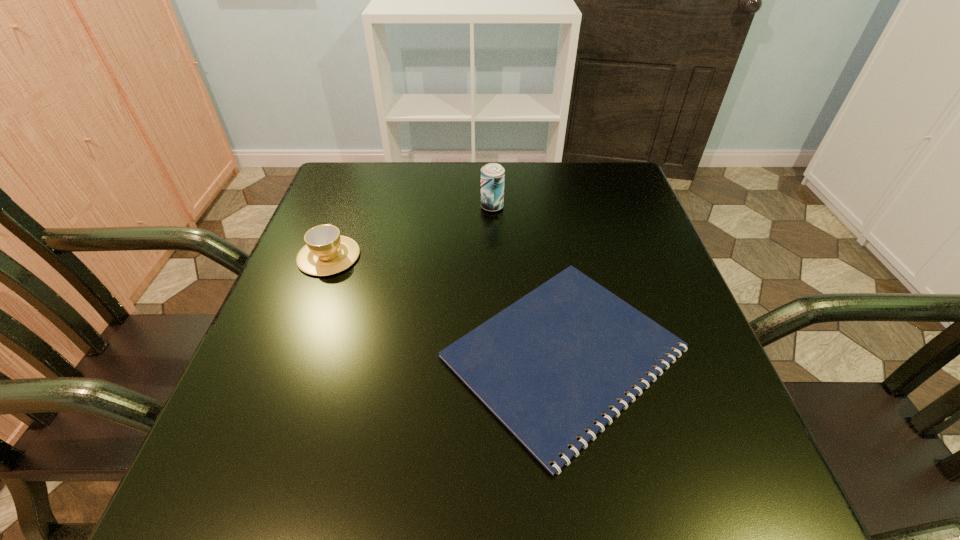
At what (x,y) coordinates should I click in order to perform the action: click on object that is the closest one to the farthest object. Please return your answer as a coordinate pair (x, y). Looking at the image, I should click on (548, 366).

Where is `object that ranks as the closest to the shortest object`? object that ranks as the closest to the shortest object is located at coordinates (326, 252).

Find the location of `free point that satisfies the following two spatial constraints: 1. on the front side of the beer can; 2. on the right side of the shortest object`. free point that satisfies the following two spatial constraints: 1. on the front side of the beer can; 2. on the right side of the shortest object is located at coordinates (497, 353).

Find the location of a particular element. The image size is (960, 540). vacant space that satisfies the following two spatial constraints: 1. with the handle on the side of the cup; 2. on the right side of the tallest object is located at coordinates (348, 207).

Locate an element on the screen. Image resolution: width=960 pixels, height=540 pixels. free point that satisfies the following two spatial constraints: 1. with the handle on the side of the cup; 2. on the right side of the beer can is located at coordinates (348, 207).

Where is `blank area in the image that satisfies the following two spatial constraints: 1. with the handle on the side of the farthest object; 2. on the right side of the second tallest object`? The image size is (960, 540). blank area in the image that satisfies the following two spatial constraints: 1. with the handle on the side of the farthest object; 2. on the right side of the second tallest object is located at coordinates click(348, 207).

The width and height of the screenshot is (960, 540). In order to click on vacant space that satisfies the following two spatial constraints: 1. with the handle on the side of the farthest object; 2. on the right side of the leftmost object in this screenshot , I will do `click(348, 207)`.

Locate an element on the screen. vacant space that satisfies the following two spatial constraints: 1. with the handle on the side of the leftmost object; 2. on the right side of the tallest object is located at coordinates (348, 207).

The height and width of the screenshot is (540, 960). In order to click on vacant space that satisfies the following two spatial constraints: 1. with the handle on the side of the beer can; 2. on the left side of the second tallest object in this screenshot , I will do `click(348, 207)`.

Locate an element on the screen. The height and width of the screenshot is (540, 960). free region that satisfies the following two spatial constraints: 1. with the handle on the side of the beer can; 2. on the right side of the second shortest object is located at coordinates (348, 207).